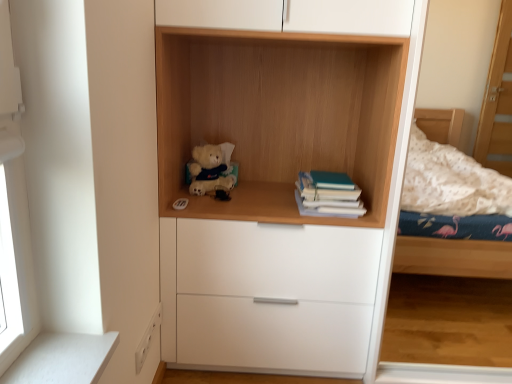
Question: Is teal matte book at right bigger than wooden shelf at center?

Choices:
 (A) yes
 (B) no

Answer: (B)

Question: Is teal matte book at right thinner than wooden shelf at center?

Choices:
 (A) no
 (B) yes

Answer: (B)

Question: From the image's perspective, does teal matte book at right appear lower than wooden shelf at center?

Choices:
 (A) no
 (B) yes

Answer: (B)

Question: From a real-world perspective, is teal matte book at right located beneath wooden shelf at center?

Choices:
 (A) yes
 (B) no

Answer: (A)

Question: Is teal matte book at right facing away from wooden shelf at center?

Choices:
 (A) no
 (B) yes

Answer: (B)

Question: In terms of height, does soft plush teddy bear at center look taller or shorter compared to wooden shelf at center?

Choices:
 (A) tall
 (B) short

Answer: (B)

Question: From the image's perspective, is soft plush teddy bear at center positioned above or below wooden shelf at center?

Choices:
 (A) above
 (B) below

Answer: (B)

Question: Based on their sizes in the image, would you say soft plush teddy bear at center is bigger or smaller than wooden shelf at center?

Choices:
 (A) big
 (B) small

Answer: (B)

Question: Considering their positions, is soft plush teddy bear at center located in front of or behind wooden shelf at center?

Choices:
 (A) behind
 (B) front

Answer: (A)

Question: From a real-world perspective, is teal matte book at right physically located above or below wooden shelf at center?

Choices:
 (A) above
 (B) below

Answer: (B)

Question: Is teal matte book at right spatially inside wooden shelf at center, or outside of it?

Choices:
 (A) inside
 (B) outside

Answer: (A)

Question: Is point (317, 175) positioned closer to the camera than point (298, 76)?

Choices:
 (A) closer
 (B) farther

Answer: (A)

Question: Considering their positions, is teal matte book at right located in front of or behind wooden shelf at center?

Choices:
 (A) front
 (B) behind

Answer: (B)

Question: From a real-world perspective, is soft plush teddy bear at center above or below teal matte book at right?

Choices:
 (A) below
 (B) above

Answer: (B)

Question: Considering the positions of point (190, 180) and point (329, 195), is point (190, 180) closer or farther from the camera than point (329, 195)?

Choices:
 (A) farther
 (B) closer

Answer: (A)